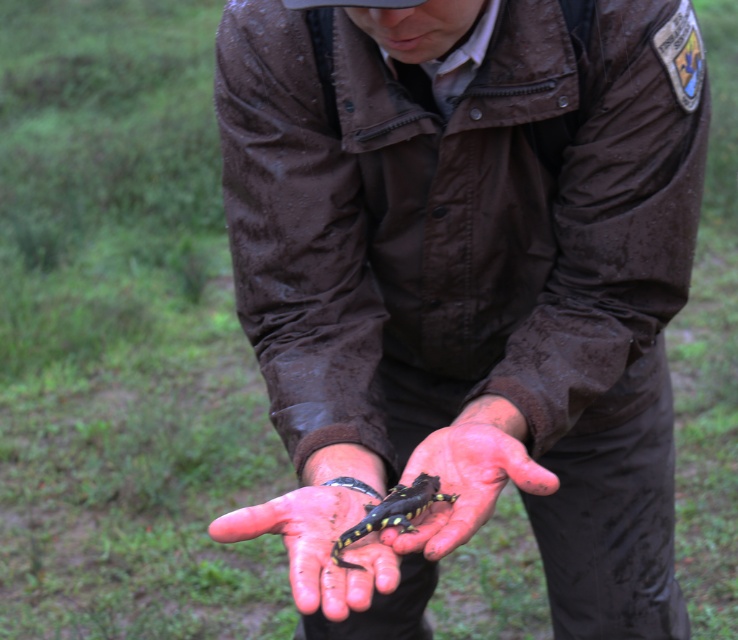
Question: Can you confirm if brown leather jacket at center is wider than smooth skin hand at center?

Choices:
 (A) yes
 (B) no

Answer: (A)

Question: Estimate the real-world distances between objects in this image. Which object is closer to the yellow spotted lizard at center?

Choices:
 (A) smooth skin hand at center
 (B) brown leather jacket at center

Answer: (A)

Question: Which object appears closest to the camera in this image?

Choices:
 (A) brown leather jacket at center
 (B) yellow spotted lizard at center
 (C) smooth skin hand at center

Answer: (B)

Question: Considering the relative positions of brown leather jacket at center and smooth skin hand at center in the image provided, where is brown leather jacket at center located with respect to smooth skin hand at center?

Choices:
 (A) right
 (B) left

Answer: (A)

Question: Which object is the farthest from the yellow spotted lizard at center?

Choices:
 (A) smooth skin hand at center
 (B) brown leather jacket at center

Answer: (B)

Question: Does brown leather jacket at center come behind smooth skin hand at center?

Choices:
 (A) yes
 (B) no

Answer: (B)